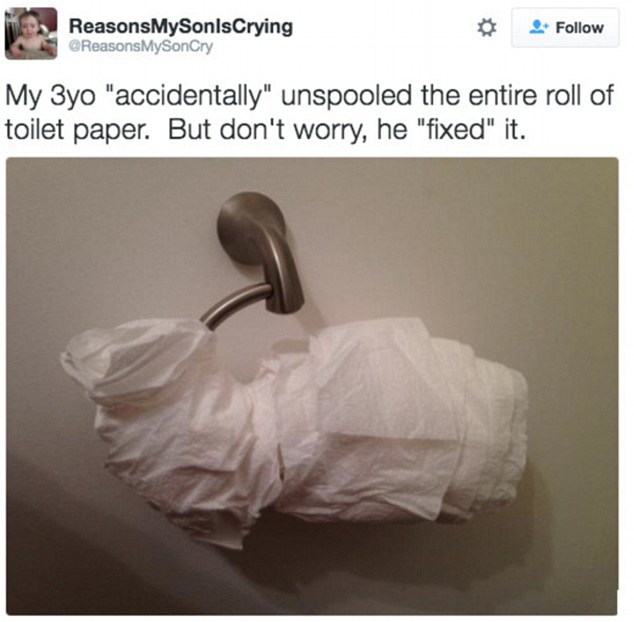
Where is `tissue holder`? The height and width of the screenshot is (622, 634). tissue holder is located at coordinates (281, 281).